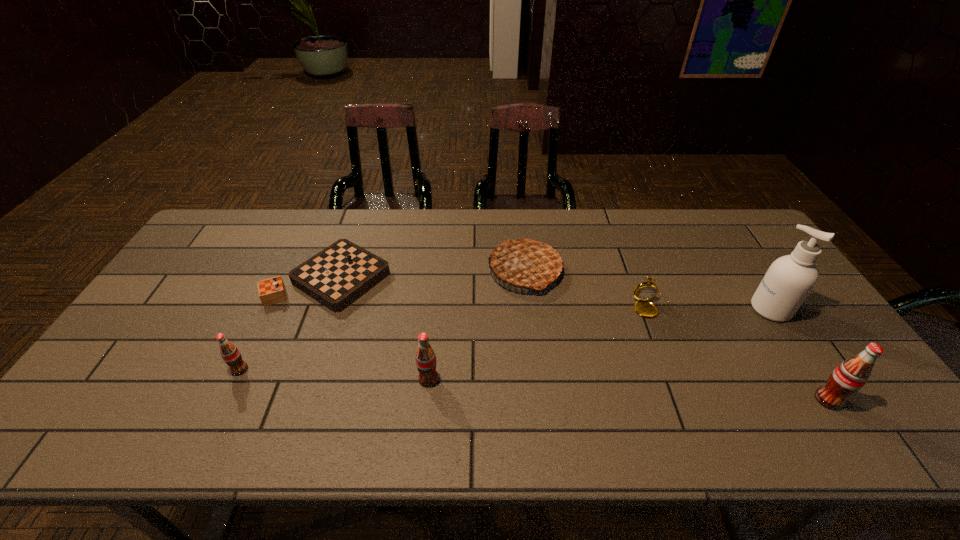
Find the location of a particular element. the shortest soda is located at coordinates tap(229, 352).

Locate an element on the screen. The width and height of the screenshot is (960, 540). the leftmost soda is located at coordinates (229, 352).

What are the coordinates of `the second tallest soda` in the screenshot? It's located at tap(426, 362).

Identify the location of the second soda from left to right. [x=426, y=362].

This screenshot has height=540, width=960. I want to click on the rightmost soda, so click(850, 376).

Where is `the nearest soda`? This screenshot has width=960, height=540. the nearest soda is located at coordinates (850, 376).

At what (x,y) coordinates should I click in order to perform the action: click on pocket watch. Please return your answer as a coordinate pair (x, y). The width and height of the screenshot is (960, 540). Looking at the image, I should click on (644, 291).

Locate an element on the screen. The width and height of the screenshot is (960, 540). the sixth tallest object is located at coordinates (644, 291).

You are a GUI agent. You are given a task and a screenshot of the screen. Output one action in this format:
    pyautogui.click(x=<x>, y=<y>)
    Task: Click on the fourth object from right to left
    Image resolution: width=960 pixels, height=540 pixels.
    Given the screenshot: What is the action you would take?
    pyautogui.click(x=525, y=263)

Identify the location of the tallest object. The height and width of the screenshot is (540, 960). (789, 280).